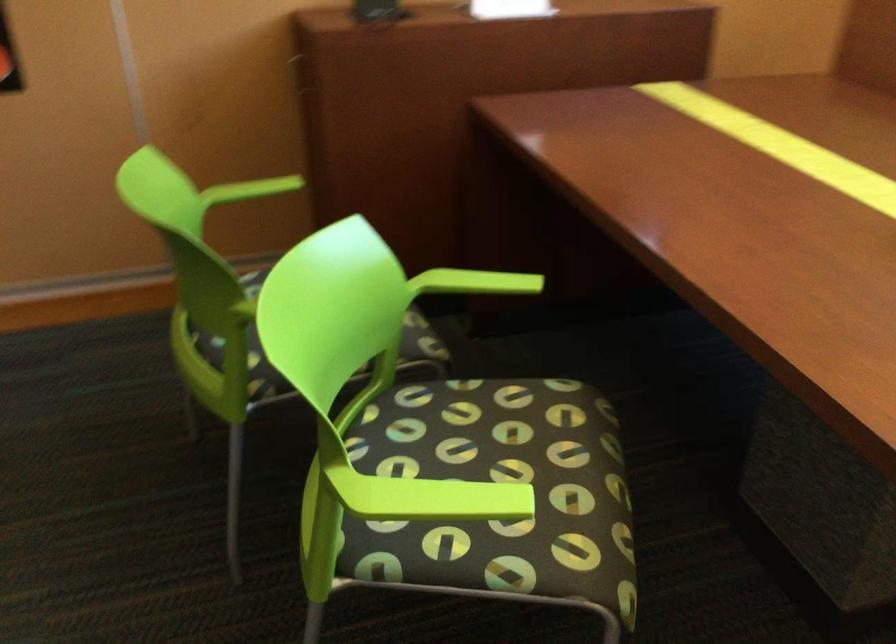
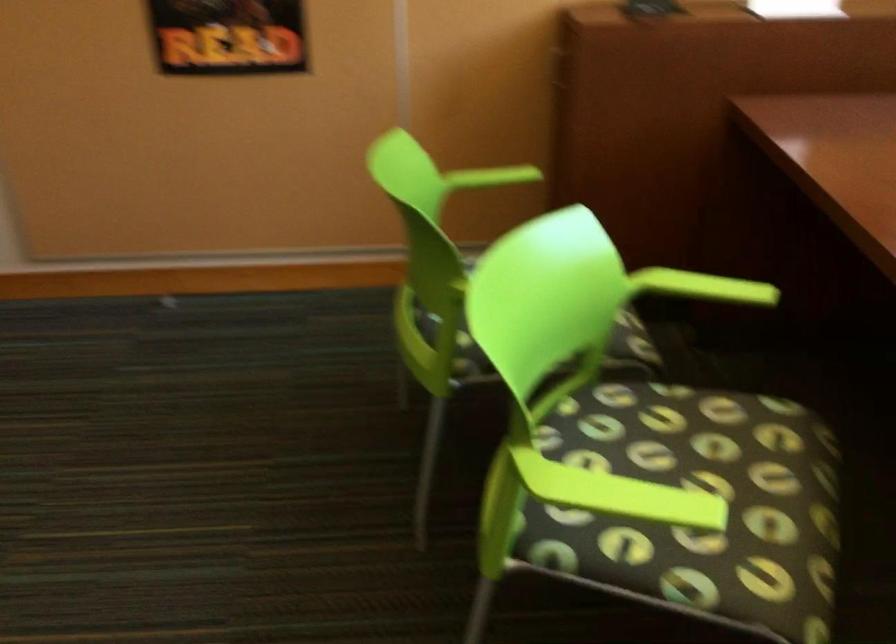
Where in the second image is the point corresponding to point (512, 464) from the first image?

(708, 482)